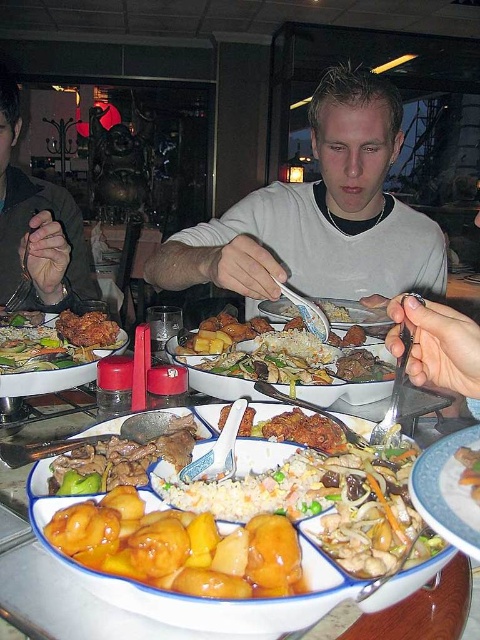
Based on the photo, can you confirm if golden glazed meat at center is shorter than golden crispy chicken at center?

Yes, golden glazed meat at center is shorter than golden crispy chicken at center.

Does golden glazed meat at center lie behind golden crispy chicken at center?

No, it is in front of golden crispy chicken at center.

Is point (96, 486) closer to camera compared to point (17, 326)?

Yes.

Image resolution: width=480 pixels, height=640 pixels. What are the coordinates of `golden glazed meat at center` in the screenshot? It's located at (121, 458).

How far apart are glossy yellow fruit at center and shiny plastic fork at center?

27.78 inches

Measure the distance between point (86, 502) and camera.

Point (86, 502) is 42.38 centimeters away from camera.

Find the location of `glossy yellow fruit at center`. glossy yellow fruit at center is located at coordinates point(180,547).

Is wooden chopsticks at center thinner than shiny plastic fork at center?

Yes, wooden chopsticks at center is thinner than shiny plastic fork at center.

Is point (468, 509) behind point (365, 317)?

No, it is in front of (365, 317).

Which is behind, point (423, 513) or point (376, 310)?

Point (376, 310)

This screenshot has width=480, height=640. Find the location of `wooden chopsticks at center`. wooden chopsticks at center is located at coordinates (447, 492).